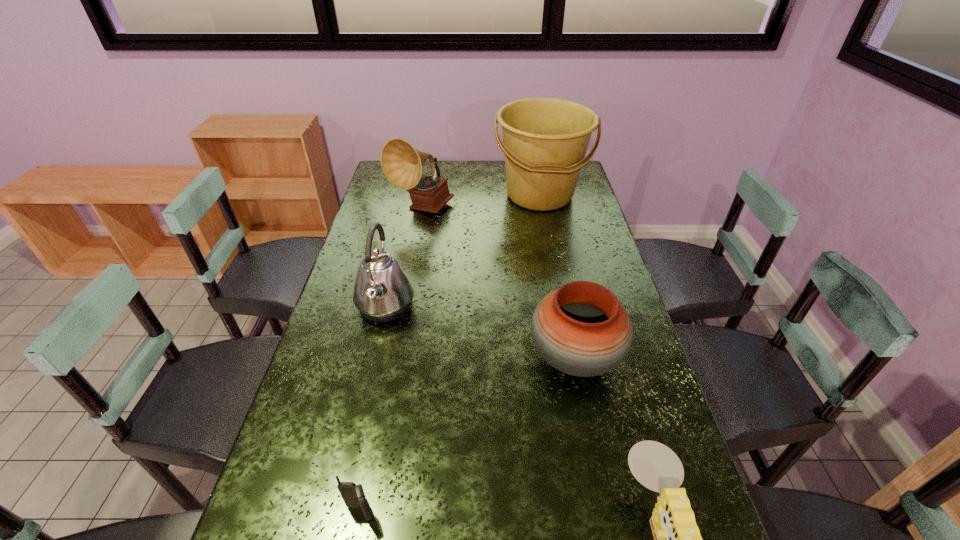
Find the location of a particular element. Image resolution: width=960 pixels, height=540 pixels. bucket is located at coordinates (545, 140).

Locate an element on the screen. This screenshot has width=960, height=540. phonograph record is located at coordinates (402, 164).

The image size is (960, 540). I want to click on kettle, so click(383, 292).

Find the location of a particular element. the fourth tallest object is located at coordinates (581, 329).

The height and width of the screenshot is (540, 960). I want to click on the shortest object, so click(353, 495).

Where is `blank space located on the side of the bucket with the handle`? The image size is (960, 540). blank space located on the side of the bucket with the handle is located at coordinates (546, 230).

Locate an element on the screen. This screenshot has width=960, height=540. blank space located 0.240m on the horn of the phonograph record is located at coordinates pos(411,266).

The height and width of the screenshot is (540, 960). Find the location of `vacant space situated 0.390m on the back of the kettle`. vacant space situated 0.390m on the back of the kettle is located at coordinates [406, 216].

At what (x,y) coordinates should I click in order to perform the action: click on vacant region located 0.050m on the right of the third shortest object. Please return your answer as a coordinate pair (x, y). Looking at the image, I should click on (640, 358).

The height and width of the screenshot is (540, 960). Identify the location of object that is at the far edge. tap(545, 140).